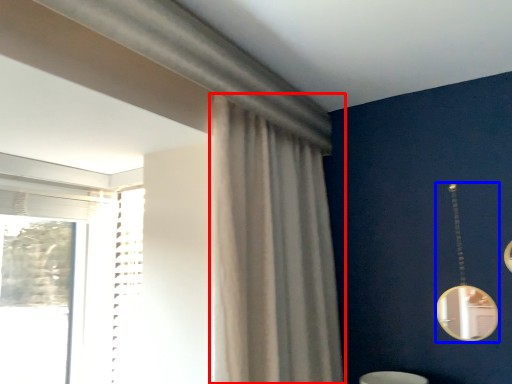
Question: Which of the following is the farthest to the observer, curtain (highlighted by a red box) or mirror (highlighted by a blue box)?

Choices:
 (A) curtain
 (B) mirror

Answer: (B)